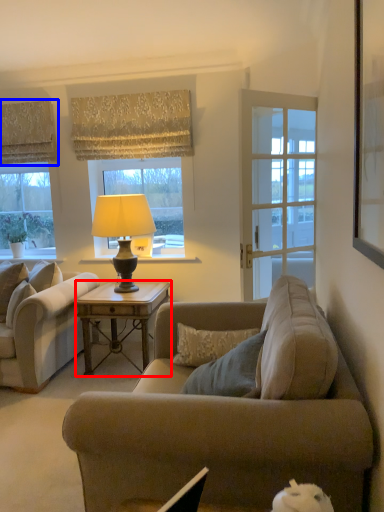
Question: Which point is further to the camera, desk (highlighted by a red box) or curtain (highlighted by a blue box)?

Choices:
 (A) desk
 (B) curtain

Answer: (B)